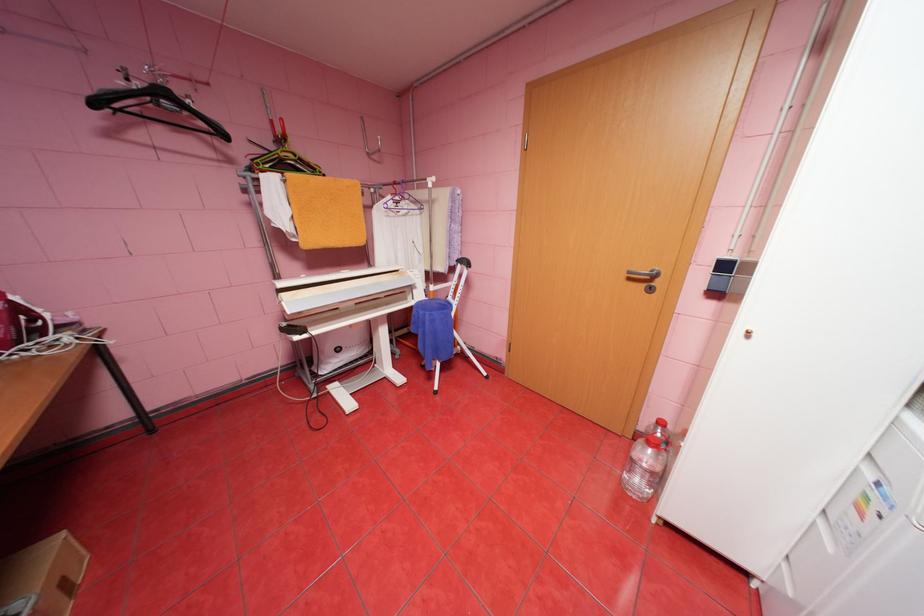
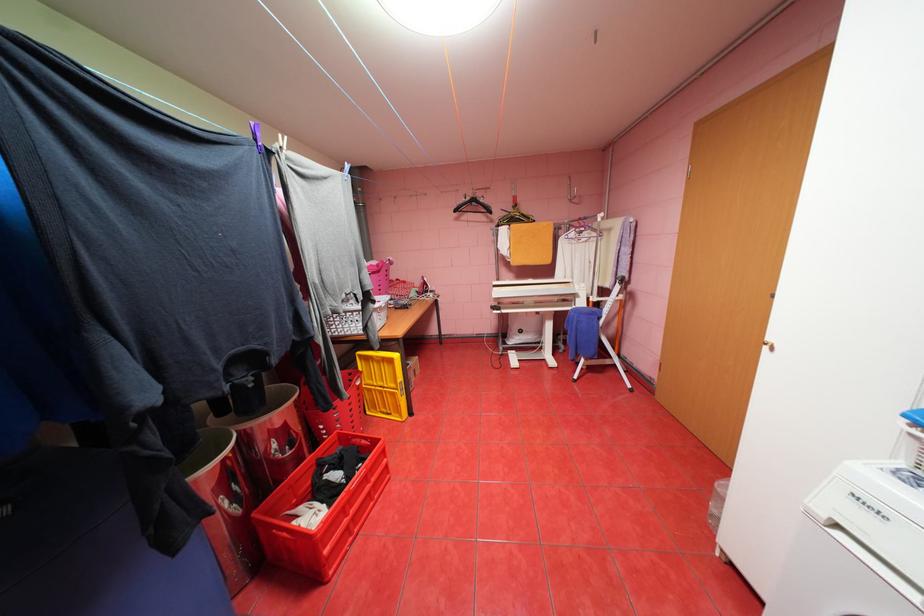
Find the pixel in the second image that matches (x=407, y=180) in the first image.

(591, 216)